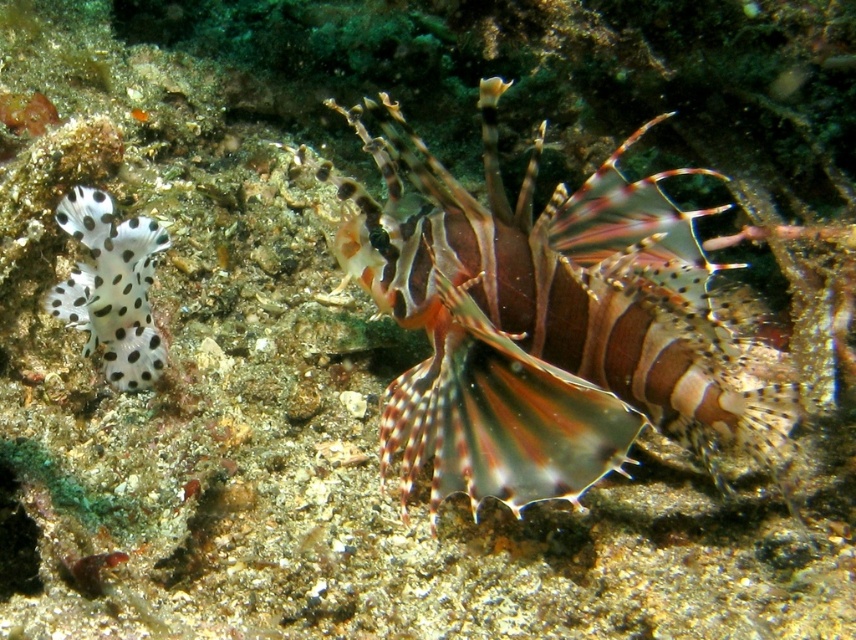
Question: Is multicolored spiny fish at center in front of white spotted sponge at left?

Choices:
 (A) no
 (B) yes

Answer: (B)

Question: Which point is farther to the camera?

Choices:
 (A) (82, 232)
 (B) (724, 420)

Answer: (B)

Question: Does multicolored spiny fish at center appear on the left side of white spotted sponge at left?

Choices:
 (A) no
 (B) yes

Answer: (A)

Question: Does multicolored spiny fish at center lie behind white spotted sponge at left?

Choices:
 (A) yes
 (B) no

Answer: (B)

Question: Which point appears closest to the camera in this image?

Choices:
 (A) (542, 298)
 (B) (70, 284)

Answer: (A)